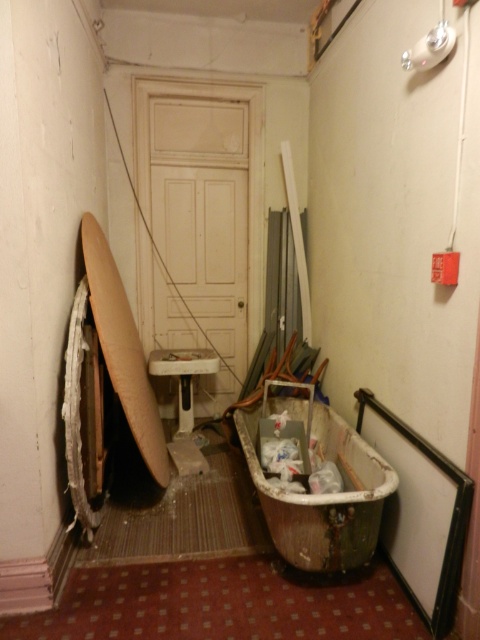
Which is more to the right, rusty metal bathtub at center or light brown wooden surfboard at left?

Positioned to the right is rusty metal bathtub at center.

Consider the image. Can you confirm if rusty metal bathtub at center is smaller than light brown wooden surfboard at left?

Correct, rusty metal bathtub at center occupies less space than light brown wooden surfboard at left.

Who is more distant from viewer, (245, 424) or (86, 220)?

The point (245, 424) is more distant.

I want to click on rusty metal bathtub at center, so click(322, 493).

Is point (222, 83) farther from viewer compared to point (104, 292)?

That is True.

This screenshot has height=640, width=480. Find the location of `white matte door at center`. white matte door at center is located at coordinates (201, 218).

Which is more to the right, white matte door at center or rusty metal bathtub at center?

Positioned to the right is rusty metal bathtub at center.

Between point (251, 296) and point (299, 512), which one is positioned behind?

The point (251, 296) is behind.

Who is more forward, (164, 150) or (319, 560)?

Positioned in front is point (319, 560).

What are the coordinates of `white matte door at center` in the screenshot? It's located at (201, 218).